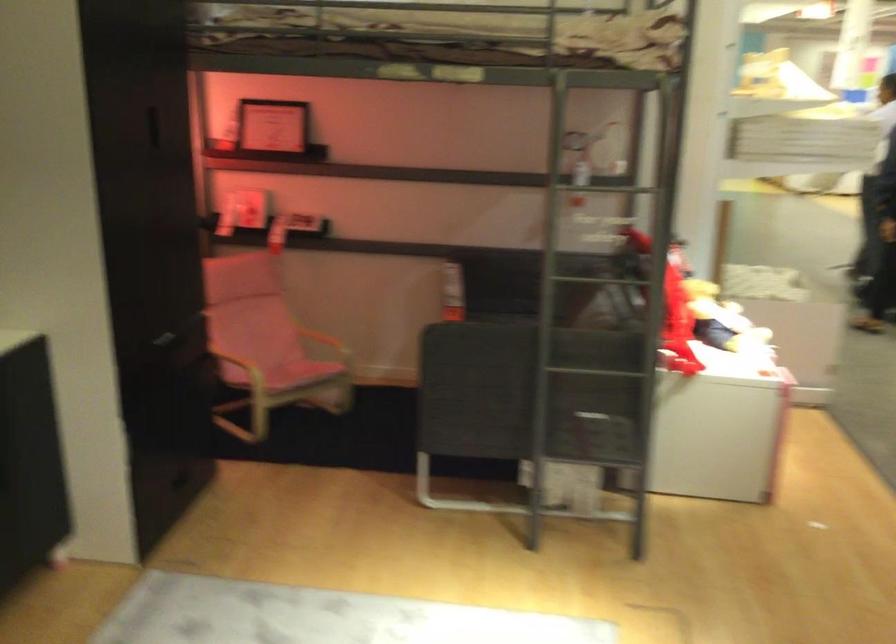
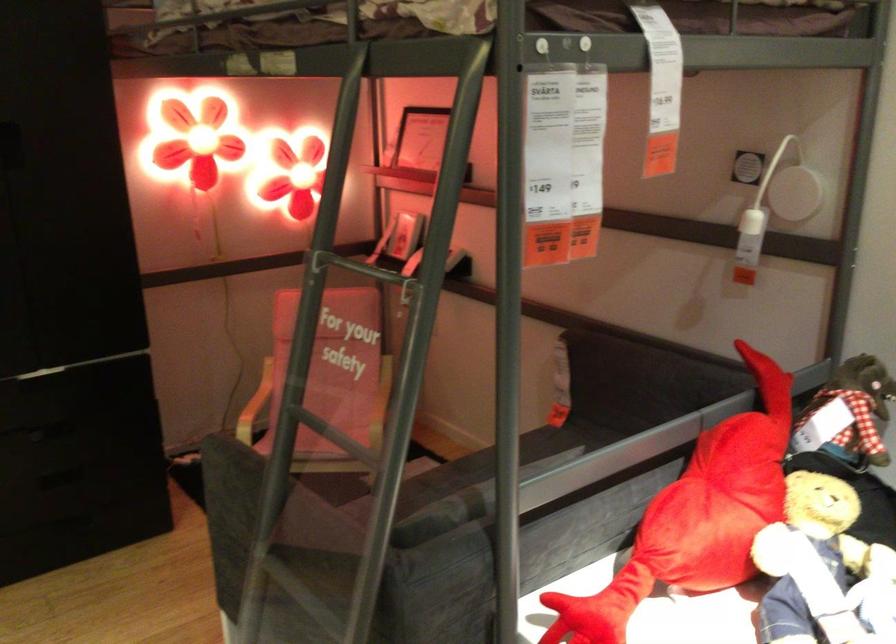
Where in the second image is the point corresponding to the point at 614,187 from the first image?

(354, 267)